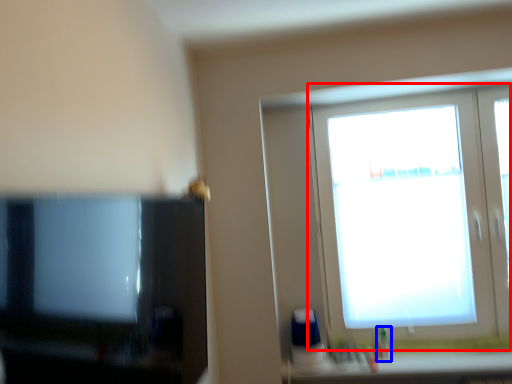
Question: Which object is closer to the camera taking this photo, window (highlighted by a red box) or toiletry (highlighted by a blue box)?

Choices:
 (A) window
 (B) toiletry

Answer: (A)